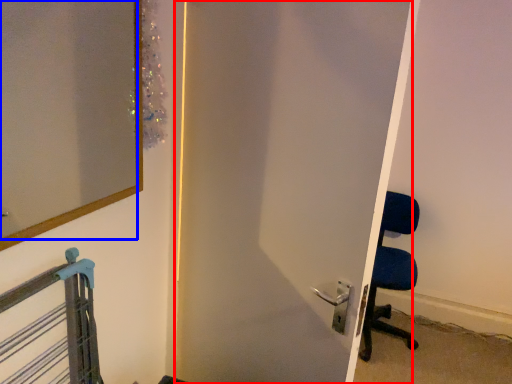
Question: Among these objects, which one is farthest to the camera, door (highlighted by a red box) or mirror (highlighted by a blue box)?

Choices:
 (A) door
 (B) mirror

Answer: (A)